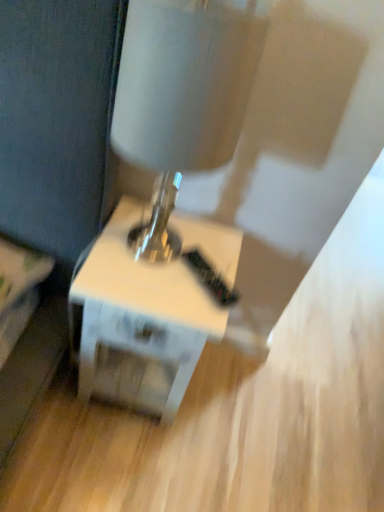
Question: Is metallic silver table lamp at center further to the viewer compared to white glossy table at center?

Choices:
 (A) no
 (B) yes

Answer: (A)

Question: Is metallic silver table lamp at center shorter than white glossy table at center?

Choices:
 (A) yes
 (B) no

Answer: (B)

Question: Is metallic silver table lamp at center bigger than white glossy table at center?

Choices:
 (A) no
 (B) yes

Answer: (A)

Question: Would you consider metallic silver table lamp at center to be distant from white glossy table at center?

Choices:
 (A) yes
 (B) no

Answer: (B)

Question: Can you confirm if metallic silver table lamp at center is wider than white glossy table at center?

Choices:
 (A) yes
 (B) no

Answer: (B)

Question: From a real-world perspective, is metallic silver table lamp at center beneath white glossy table at center?

Choices:
 (A) yes
 (B) no

Answer: (B)

Question: Does white glossy table at center have a larger size compared to metallic silver table lamp at center?

Choices:
 (A) yes
 (B) no

Answer: (A)

Question: From the image's perspective, is white glossy table at center beneath metallic silver table lamp at center?

Choices:
 (A) no
 (B) yes

Answer: (B)

Question: Is white glossy table at center at the left side of metallic silver table lamp at center?

Choices:
 (A) yes
 (B) no

Answer: (A)

Question: Is white glossy table at center behind metallic silver table lamp at center?

Choices:
 (A) no
 (B) yes

Answer: (B)

Question: Is the depth of white glossy table at center less than that of metallic silver table lamp at center?

Choices:
 (A) yes
 (B) no

Answer: (B)

Question: Is white glossy table at center next to metallic silver table lamp at center and touching it?

Choices:
 (A) no
 (B) yes

Answer: (A)

Question: Is white glossy table at center in front of or behind metallic silver table lamp at center in the image?

Choices:
 (A) front
 (B) behind

Answer: (B)